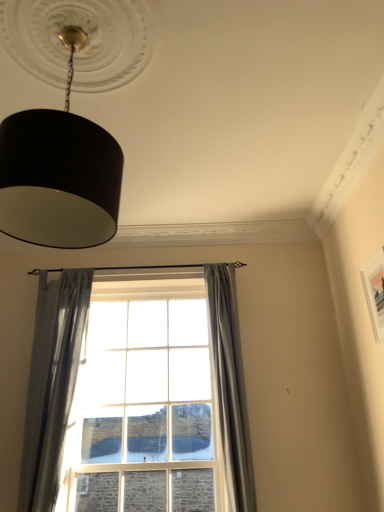
Question: From a real-world perspective, is gray sheer curtain at left, which ranks as the 2th curtain in right-to-left order, physically located above or below clear glass window at center?

Choices:
 (A) below
 (B) above

Answer: (B)

Question: Based on their sizes in the image, would you say gray sheer curtain at left, the 1th curtain positioned from the left, is bigger or smaller than clear glass window at center?

Choices:
 (A) small
 (B) big

Answer: (A)

Question: Estimate the real-world distances between objects in this image. Which object is farther from the black matte lampshade at upper left?

Choices:
 (A) clear glass window at center
 (B) gray sheer curtain at left, which ranks as the 2th curtain in right-to-left order
 (C) gray fabric curtain at center, which is the second curtain in left-to-right order

Answer: (A)

Question: Estimate the real-world distances between objects in this image. Which object is farther from the clear glass window at center?

Choices:
 (A) gray fabric curtain at center, placed as the first curtain when sorted from right to left
 (B) black matte lampshade at upper left
 (C) gray sheer curtain at left, which ranks as the 2th curtain in right-to-left order

Answer: (B)